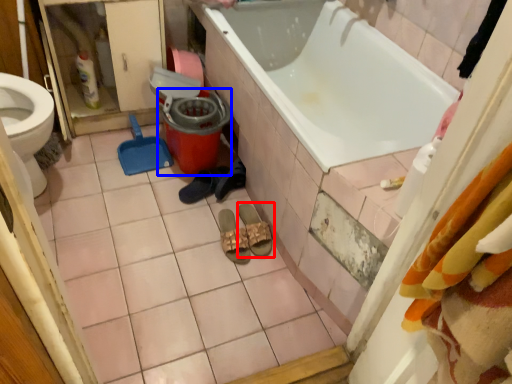
Question: Among these objects, which one is farthest to the camera, footwear (highlighted by a red box) or potty (highlighted by a blue box)?

Choices:
 (A) footwear
 (B) potty

Answer: (B)